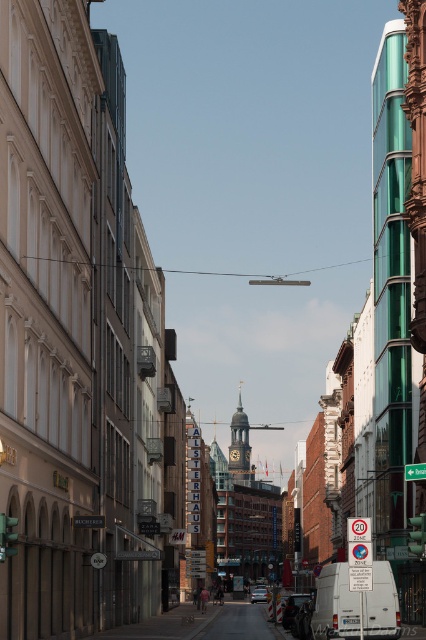
Question: Is metallic silver van at center closer to camera compared to silver metallic car at center?

Choices:
 (A) no
 (B) yes

Answer: (B)

Question: Does gold textured clock tower at center have a greater width compared to metallic silver van at center?

Choices:
 (A) yes
 (B) no

Answer: (A)

Question: Which object is closer to the camera taking this photo?

Choices:
 (A) metallic silver van at center
 (B) gold textured clock tower at center

Answer: (A)

Question: Can you confirm if gold textured clock tower at center is positioned to the right of silver metallic car at center?

Choices:
 (A) yes
 (B) no

Answer: (A)

Question: Among these objects, which one is farthest from the camera?

Choices:
 (A) metallic silver van at center
 (B) silver metallic car at center

Answer: (B)

Question: Which point appears farthest from the camera in this image?

Choices:
 (A) (238, 426)
 (B) (308, 595)
 (C) (253, 593)

Answer: (A)